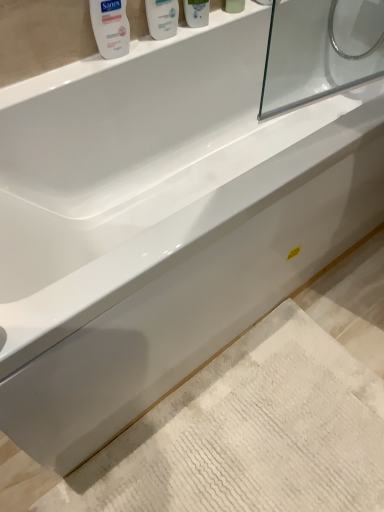
Identify the location of free space on the front side of white glossy mouthwash at upper left, the fourth mouthwash from the right. (84, 75).